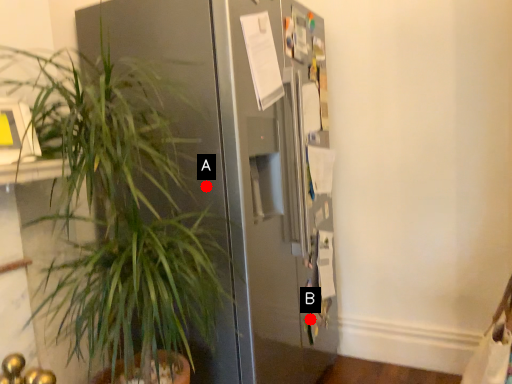
Question: Two points are circled on the image, labeled by A and B beside each circle. Which point appears farthest from the camera in this image?

Choices:
 (A) A is further
 (B) B is further

Answer: (B)